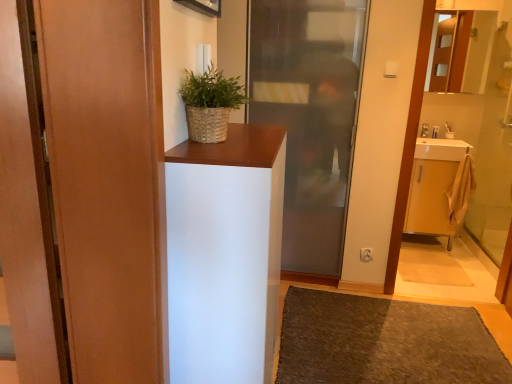
Question: In the image, is brown textured rug at lower center positioned in front of or behind woven brown basket at upper center?

Choices:
 (A) behind
 (B) front

Answer: (A)

Question: Considering the positions of point (373, 311) and point (239, 104), is point (373, 311) closer or farther from the camera than point (239, 104)?

Choices:
 (A) closer
 (B) farther

Answer: (B)

Question: Estimate the real-world distances between objects in this image. Which object is closer to the brown textured rug at lower center?

Choices:
 (A) white matte cabinet at center
 (B) woven brown basket at upper center
 (C) transparent glass door at center, the first door in the right-to-left sequence
 (D) white plastic toothbrush at upper right
 (E) matte wood door at left, marked as the first door in a left-to-right arrangement

Answer: (C)

Question: Which object is the farthest from the woven brown basket at upper center?

Choices:
 (A) white plastic toothbrush at upper right
 (B) matte wood door at left, arranged as the 2th door when viewed from the back
 (C) white matte cabinet at center
 (D) transparent glass door at center, which is the 1th door in back-to-front order
 (E) brown textured rug at lower center

Answer: (A)